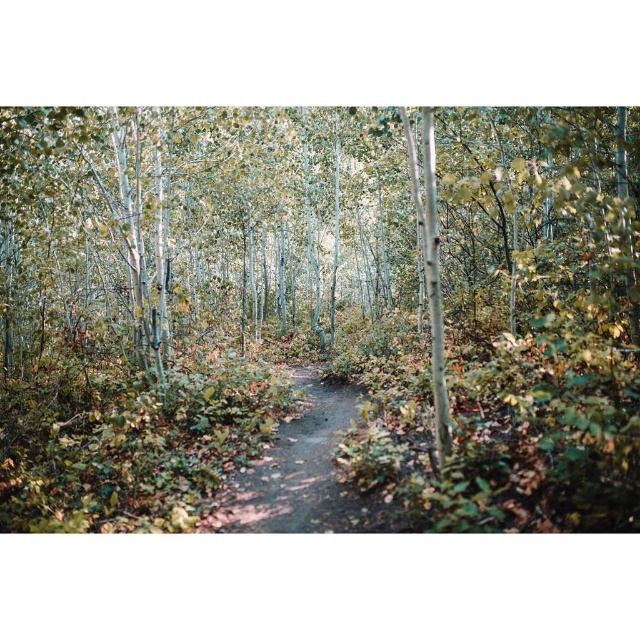
Question: Is green matte path at center wider than dirt path at center?

Choices:
 (A) yes
 (B) no

Answer: (A)

Question: Which of the following is the closest to the observer?

Choices:
 (A) dirt path at center
 (B) green matte path at center

Answer: (B)

Question: Which object appears farthest from the camera in this image?

Choices:
 (A) dirt path at center
 (B) green matte path at center

Answer: (A)

Question: Does green matte path at center have a greater width compared to dirt path at center?

Choices:
 (A) no
 (B) yes

Answer: (B)

Question: Which point is farther from the camera taking this photo?

Choices:
 (A) (544, 108)
 (B) (208, 528)

Answer: (A)

Question: Can you confirm if green matte path at center is positioned below dirt path at center?

Choices:
 (A) no
 (B) yes

Answer: (A)